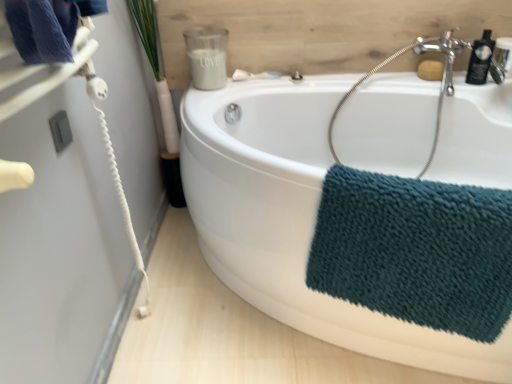
Measure the distance between satin silver jar at upper center, positioned as the 2th toiletry in right-to-left order, and camera.

satin silver jar at upper center, positioned as the 2th toiletry in right-to-left order, and camera are 5.63 feet apart.

What do you see at coordinates (207, 56) in the screenshot? The width and height of the screenshot is (512, 384). I see `satin silver jar at upper center, positioned as the 2th toiletry in right-to-left order` at bounding box center [207, 56].

The image size is (512, 384). What do you see at coordinates (415, 250) in the screenshot?
I see `teal textured towel at lower right` at bounding box center [415, 250].

This screenshot has width=512, height=384. What do you see at coordinates (156, 70) in the screenshot? I see `green leafy plant at upper left` at bounding box center [156, 70].

This screenshot has width=512, height=384. What are the coordinates of `white glossy bathtub at center` in the screenshot? It's located at (294, 220).

Is teal textured towel at lower right not within satin nickel faucet at upper right?

Absolutely, teal textured towel at lower right is external to satin nickel faucet at upper right.

Would you say teal textured towel at lower right is a long distance from satin nickel faucet at upper right?

Indeed, teal textured towel at lower right is not near satin nickel faucet at upper right.

In the scene shown: From a real-world perspective, who is located lower, teal textured towel at lower right or satin nickel faucet at upper right?

teal textured towel at lower right.

From the image's perspective, which is above, teal textured towel at lower right or satin nickel faucet at upper right?

satin nickel faucet at upper right appears higher in the image.

Could you tell me if black glossy bottle at upper right, the 1th toiletry when ordered from right to left, is turned towards green leafy plant at upper left?

No, black glossy bottle at upper right, the 1th toiletry when ordered from right to left, is not facing towards green leafy plant at upper left.

Looking at this image, from the image's perspective, who appears lower, black glossy bottle at upper right, the 1th toiletry when ordered from right to left, or green leafy plant at upper left?

From the image's view, green leafy plant at upper left is below.

From the picture: How different are the orientations of black glossy bottle at upper right, the 1th toiletry when ordered from right to left, and green leafy plant at upper left in degrees?

The angular difference between black glossy bottle at upper right, the 1th toiletry when ordered from right to left, and green leafy plant at upper left is 6.41 degrees.

Is point (480, 54) farther from viewer compared to point (164, 130)?

That is False.

Is green leafy plant at upper left shorter than satin nickel faucet at upper right?

No.

Which of these two, green leafy plant at upper left or satin nickel faucet at upper right, is wider?

green leafy plant at upper left is wider.

Between green leafy plant at upper left and satin nickel faucet at upper right, which one appears on the left side from the viewer's perspective?

green leafy plant at upper left is more to the left.

Is green leafy plant at upper left far from satin nickel faucet at upper right?

No, green leafy plant at upper left is not far away from satin nickel faucet at upper right.

Does satin nickel faucet at upper right appear on the left side of black glossy bottle at upper right, which appears as the second toiletry when viewed from the left?

In fact, satin nickel faucet at upper right is to the right of black glossy bottle at upper right, which appears as the second toiletry when viewed from the left.

Can you tell me how much satin nickel faucet at upper right and black glossy bottle at upper right, which appears as the second toiletry when viewed from the left, differ in facing direction?

satin nickel faucet at upper right and black glossy bottle at upper right, which appears as the second toiletry when viewed from the left, are facing 0.000494 degrees away from each other.

Is satin nickel faucet at upper right not within black glossy bottle at upper right, which appears as the second toiletry when viewed from the left?

Absolutely, satin nickel faucet at upper right is external to black glossy bottle at upper right, which appears as the second toiletry when viewed from the left.

Which of these two, satin nickel faucet at upper right or black glossy bottle at upper right, which appears as the second toiletry when viewed from the left, is bigger?

With larger size is satin nickel faucet at upper right.

Identify the location of plant on the left of teal textured towel at lower right. (156, 70).

Considering the sizes of teal textured towel at lower right and green leafy plant at upper left in the image, is teal textured towel at lower right bigger or smaller than green leafy plant at upper left?

teal textured towel at lower right is bigger than green leafy plant at upper left.

Is point (469, 72) in front of point (333, 299)?

No, it is not.

Which is more to the right, black glossy bottle at upper right, the 1th toiletry when ordered from right to left, or white glossy bathtub at center?

black glossy bottle at upper right, the 1th toiletry when ordered from right to left.

Is black glossy bottle at upper right, the 1th toiletry when ordered from right to left, next to white glossy bathtub at center and touching it?

No, black glossy bottle at upper right, the 1th toiletry when ordered from right to left, is not making contact with white glossy bathtub at center.

From the image's perspective, would you say black glossy bottle at upper right, the 1th toiletry when ordered from right to left, is shown under white glossy bathtub at center?

Incorrect, from the image's perspective, black glossy bottle at upper right, the 1th toiletry when ordered from right to left, is higher than white glossy bathtub at center.

From the image's perspective, would you say white glossy bathtub at center is shown under green leafy plant at upper left?

Yes, from the image's perspective, white glossy bathtub at center is beneath green leafy plant at upper left.

Considering the sizes of objects white glossy bathtub at center and green leafy plant at upper left in the image provided, who is thinner, white glossy bathtub at center or green leafy plant at upper left?

green leafy plant at upper left.

Which is in front, white glossy bathtub at center or green leafy plant at upper left?

white glossy bathtub at center is in front.

The image size is (512, 384). Identify the location of beach towel below the satin nickel faucet at upper right (from the image's perspective). (415, 250).

The height and width of the screenshot is (384, 512). I want to click on plant in front of the black glossy bottle at upper right, which appears as the second toiletry when viewed from the left, so click(x=156, y=70).

From the image, which object appears to be farther from satin nickel faucet at upper right, black glossy bottle at upper right, which appears as the second toiletry when viewed from the left, or satin nickel faucet at upper right?

satin nickel faucet at upper right.

From the image, which object appears to be farther from satin silver jar at upper center, marked as the 1th toiletry in a left-to-right arrangement, green leafy plant at upper left or black glossy bottle at upper right, the 1th toiletry when ordered from right to left?

The object further to satin silver jar at upper center, marked as the 1th toiletry in a left-to-right arrangement, is black glossy bottle at upper right, the 1th toiletry when ordered from right to left.

Looking at the image, which one is located closer to green leafy plant at upper left, satin silver jar at upper center, positioned as the 2th toiletry in right-to-left order, or teal textured towel at lower right?

satin silver jar at upper center, positioned as the 2th toiletry in right-to-left order, is closer to green leafy plant at upper left.

When comparing their distances from teal textured towel at lower right, does satin nickel faucet at upper right or white glossy bathtub at center seem closer?

Based on the image, white glossy bathtub at center appears to be nearer to teal textured towel at lower right.

Consider the image. Looking at the image, which one is located closer to green leafy plant at upper left, satin nickel faucet at upper right or white glossy bathtub at center?

Among the two, white glossy bathtub at center is located nearer to green leafy plant at upper left.

Which object lies nearer to the anchor point black glossy bottle at upper right, which appears as the second toiletry when viewed from the left, green leafy plant at upper left or satin silver jar at upper center, marked as the 1th toiletry in a left-to-right arrangement?

The object closer to black glossy bottle at upper right, which appears as the second toiletry when viewed from the left, is satin silver jar at upper center, marked as the 1th toiletry in a left-to-right arrangement.

Based on their spatial positions, is black glossy bottle at upper right, the 1th toiletry when ordered from right to left, or satin nickel faucet at upper right closer to satin nickel faucet at upper right?

black glossy bottle at upper right, the 1th toiletry when ordered from right to left, is positioned closer to the anchor satin nickel faucet at upper right.

Based on the photo, from the image, which object appears to be farther from green leafy plant at upper left, black glossy bottle at upper right, the 1th toiletry when ordered from right to left, or white glossy bathtub at center?

black glossy bottle at upper right, the 1th toiletry when ordered from right to left, is positioned further to the anchor green leafy plant at upper left.

At what (x,y) coordinates should I click in order to perform the action: click on beach towel between green leafy plant at upper left and white glossy bathtub at center. Please return your answer as a coordinate pair (x, y). This screenshot has width=512, height=384. Looking at the image, I should click on (415, 250).

This screenshot has height=384, width=512. I want to click on beach towel located between satin silver jar at upper center, positioned as the 2th toiletry in right-to-left order, and satin nickel faucet at upper right in the left-right direction, so click(x=415, y=250).

This screenshot has width=512, height=384. In order to click on beach towel between green leafy plant at upper left and satin nickel faucet at upper right in the horizontal direction in this screenshot , I will do `click(415, 250)`.

You are a GUI agent. You are given a task and a screenshot of the screen. Output one action in this format:
    pyautogui.click(x=<x>, y=<y>)
    Task: Click on the plant located between white glossy bathtub at center and satin silver jar at upper center, positioned as the 2th toiletry in right-to-left order, in the depth direction
    The width and height of the screenshot is (512, 384).
    Given the screenshot: What is the action you would take?
    pyautogui.click(x=156, y=70)